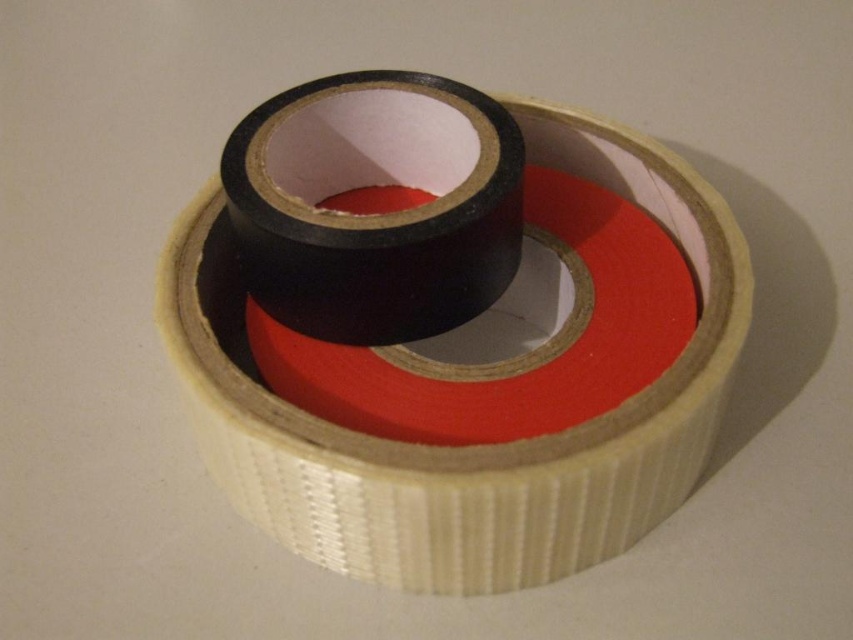
Question: Can you confirm if black matte tape at center is wider than matte black tape at center?

Choices:
 (A) no
 (B) yes

Answer: (B)

Question: Which point is closer to the camera?

Choices:
 (A) (648, 394)
 (B) (473, 164)

Answer: (A)

Question: Can you confirm if black matte tape at center is wider than matte black tape at center?

Choices:
 (A) no
 (B) yes

Answer: (B)

Question: Is black matte tape at center below matte black tape at center?

Choices:
 (A) no
 (B) yes

Answer: (B)